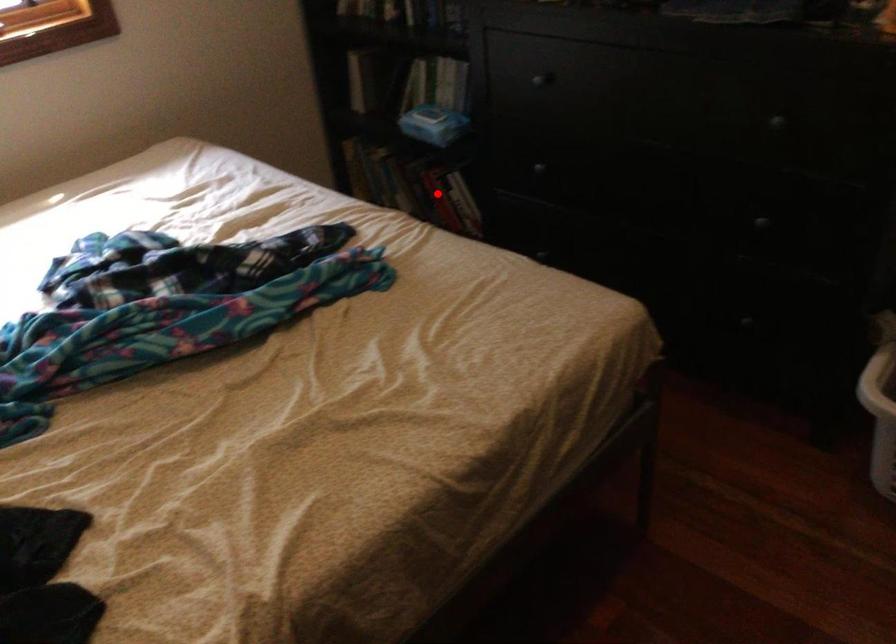
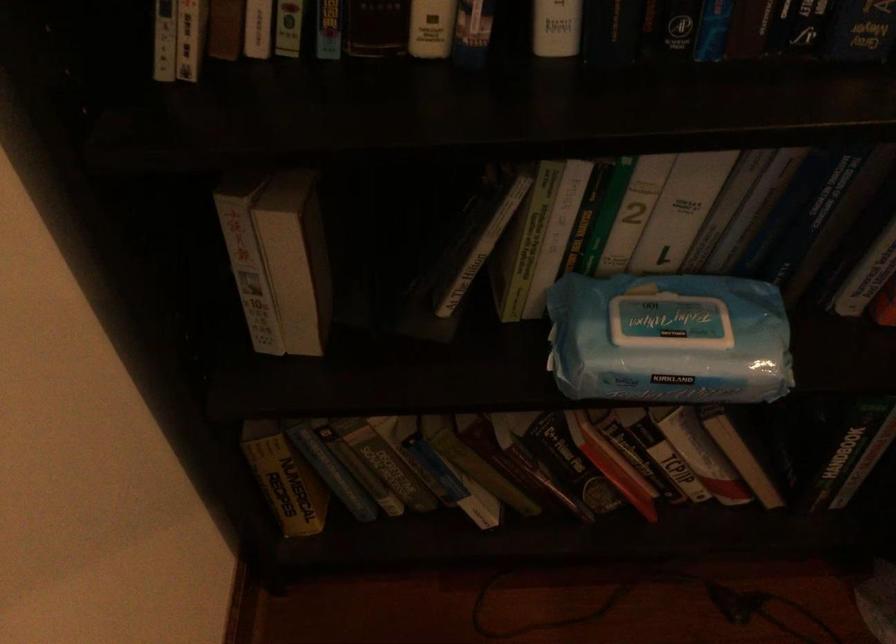
In the second image, find the point that corresponds to the highlighted location in the first image.

(610, 464)